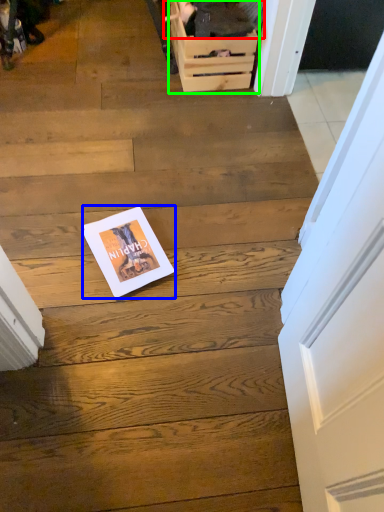
Question: Estimate the real-world distances between objects in this image. Which object is closer to couple (highlighted by a red box), magazine (highlighted by a blue box) or drawer (highlighted by a green box)?

Choices:
 (A) magazine
 (B) drawer

Answer: (B)